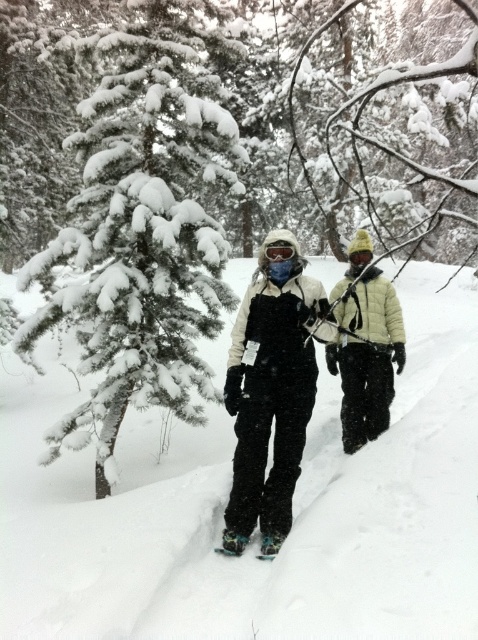
You are trying to decide which item to pack first in your backpack for the hike. The light yellow down jacket at center and the white rubber snowshoe at lower center are both essential. Based on their sizes, which item should you place in first?

The light yellow down jacket at center is bigger than the white rubber snowshoe at lower center, so you should place the light yellow down jacket at center first to optimize space in your backpack.

You are trying to locate the matte black snowsuit at center in the snowy forest. According to the coordinates provided, where exactly would you find it?

The matte black snowsuit at center is located at point (272,387).